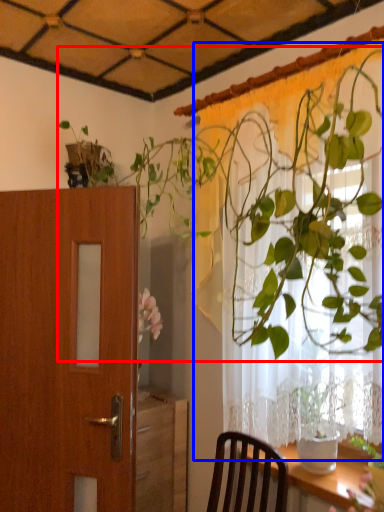
Question: Which object is further to the camera taking this photo, houseplant (highlighted by a red box) or curtain (highlighted by a blue box)?

Choices:
 (A) houseplant
 (B) curtain

Answer: (B)